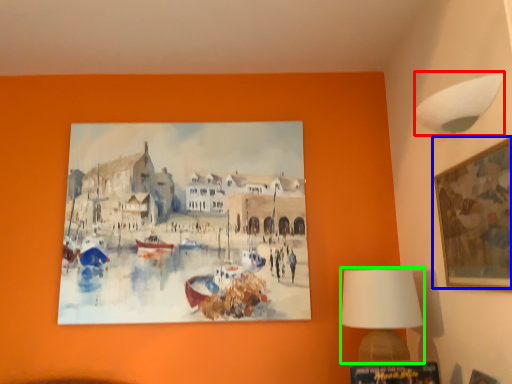
Question: Estimate the real-world distances between objects in this image. Which object is farther from lamp (highlighted by a red box), picture frame (highlighted by a blue box) or table lamp (highlighted by a green box)?

Choices:
 (A) picture frame
 (B) table lamp

Answer: (B)